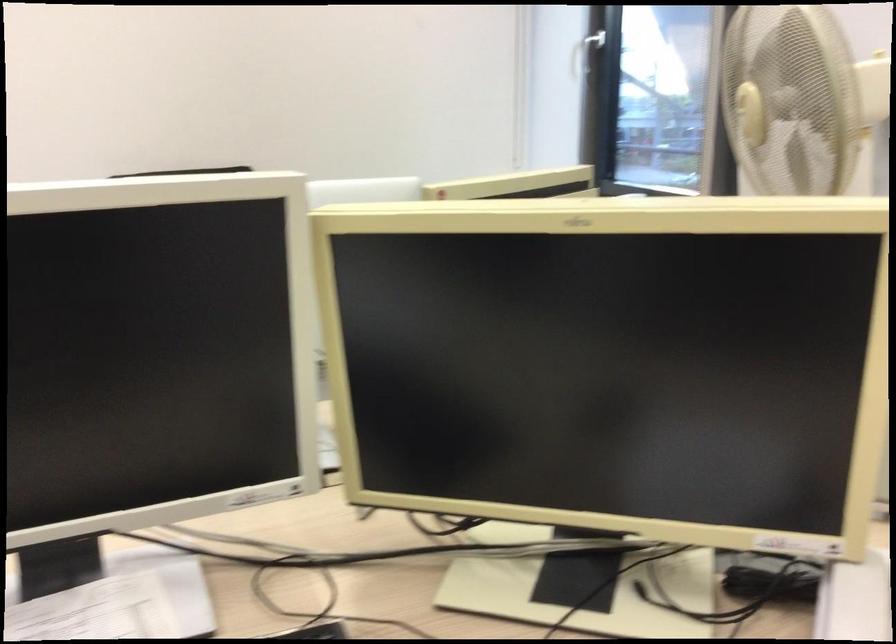
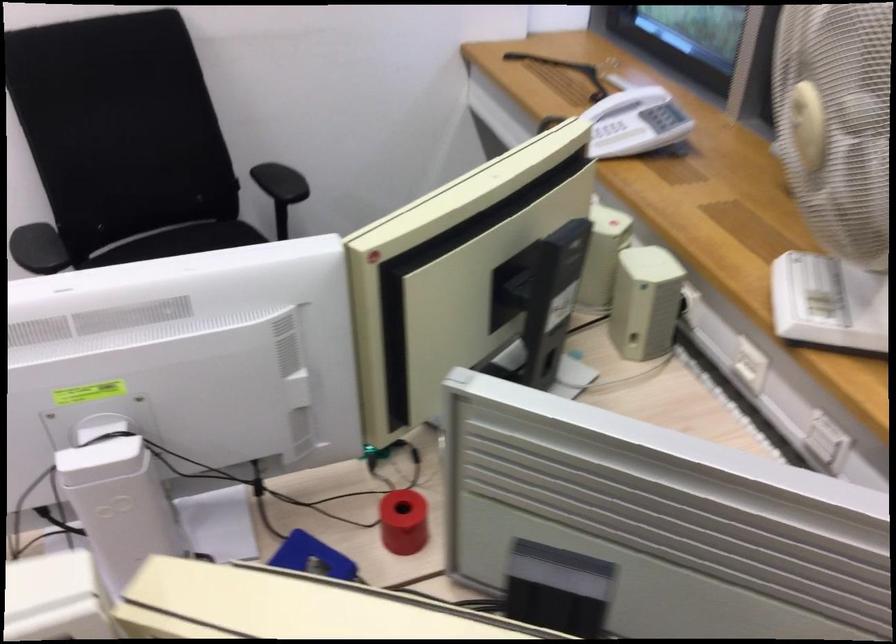
Question: Based on the continuous images, in which direction is the camera rotating? Reply with the corresponding letter.

Choices:
 (A) Left
 (B) Right
 (C) Up
 (D) Down

Answer: (D)